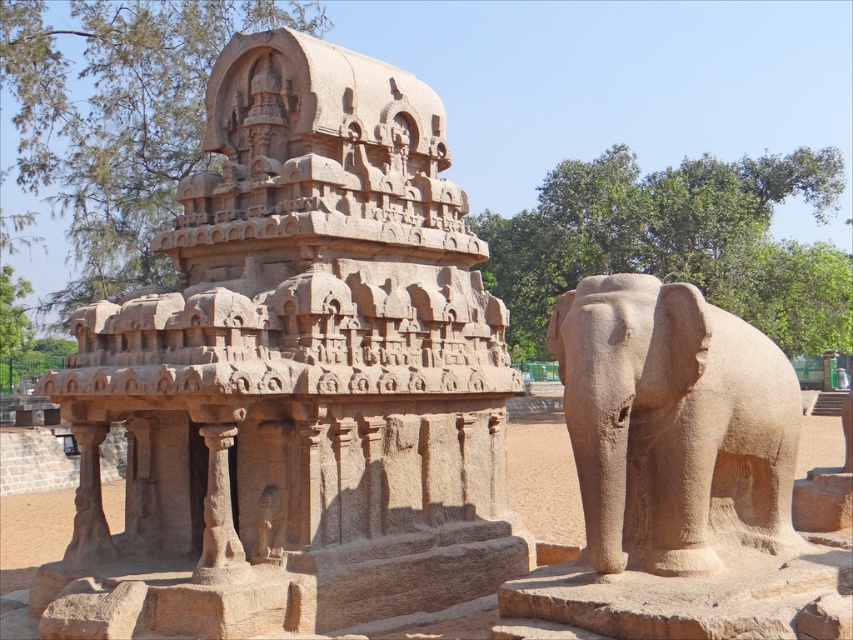
Is the position of sandy stone temple at center less distant than that of sandy stone elephant at right?

No, sandy stone temple at center is behind sandy stone elephant at right.

Is sandy stone temple at center taller than sandy stone elephant at right?

Correct, sandy stone temple at center is much taller as sandy stone elephant at right.

This screenshot has height=640, width=853. Describe the element at coordinates (299, 372) in the screenshot. I see `sandy stone temple at center` at that location.

Find the location of a particular element. Image resolution: width=853 pixels, height=640 pixels. sandy stone temple at center is located at coordinates (299, 372).